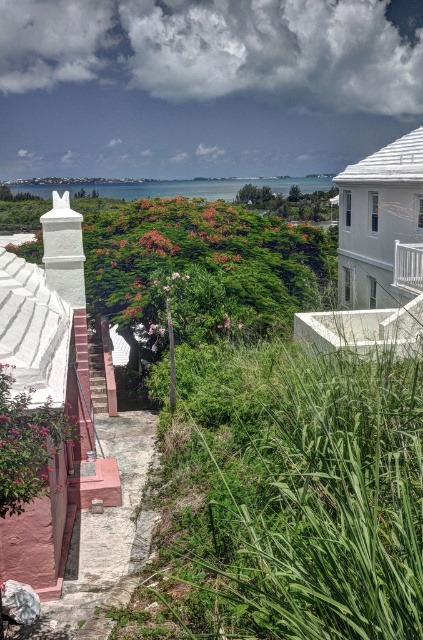
Question: Which is farther from the pink painted stairs at lower left?

Choices:
 (A) pink concrete path at lower left
 (B) white metal railing at upper right

Answer: (B)

Question: Is white metal railing at upper right below pink painted stairs at lower left?

Choices:
 (A) yes
 (B) no

Answer: (B)

Question: Does blue water at center have a larger size compared to white metal railing at upper right?

Choices:
 (A) no
 (B) yes

Answer: (B)

Question: Can you confirm if pink concrete path at lower left is positioned above white metal railing at upper right?

Choices:
 (A) no
 (B) yes

Answer: (A)

Question: Which object appears farthest from the camera in this image?

Choices:
 (A) white metal railing at upper right
 (B) pink concrete path at lower left
 (C) pink painted stairs at lower left
 (D) blue water at center

Answer: (D)

Question: Which point appears farthest from the camera in this image?

Choices:
 (A) (282, 189)
 (B) (22, 634)

Answer: (A)